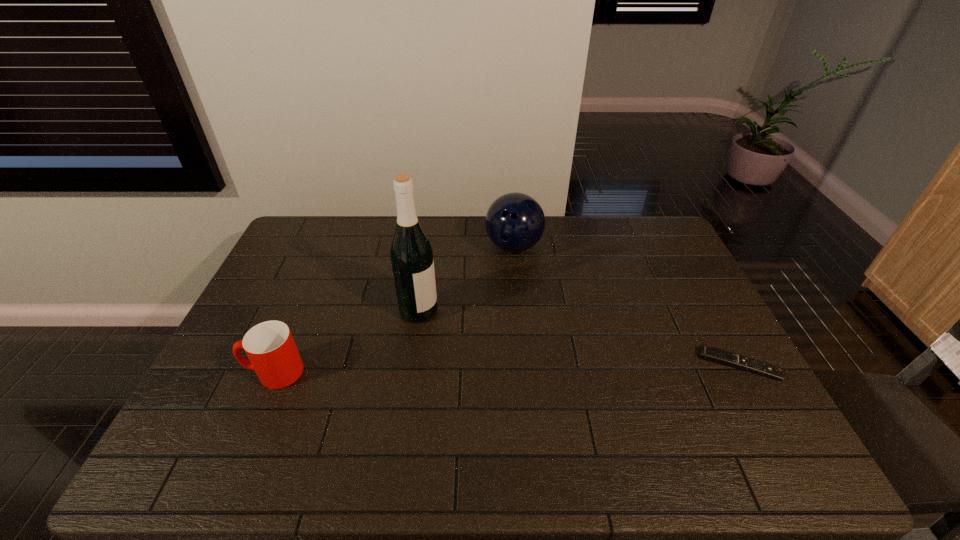
At what (x,y) coordinates should I click in order to perform the action: click on cup. Please return your answer as a coordinate pair (x, y). The image size is (960, 540). Looking at the image, I should click on (270, 347).

Find the location of a particular element. the leftmost object is located at coordinates (270, 347).

Locate an element on the screen. remote control is located at coordinates (708, 353).

Where is `the rightmost object`? The height and width of the screenshot is (540, 960). the rightmost object is located at coordinates (708, 353).

This screenshot has width=960, height=540. In order to click on the farthest object in this screenshot , I will do `click(515, 222)`.

Locate an element on the screen. The height and width of the screenshot is (540, 960). the second object from right to left is located at coordinates (515, 222).

Identify the location of wine bottle. This screenshot has width=960, height=540. (411, 254).

The height and width of the screenshot is (540, 960). I want to click on the third nearest object, so click(x=411, y=254).

Where is `vacant area located on the back of the remote control`? Image resolution: width=960 pixels, height=540 pixels. vacant area located on the back of the remote control is located at coordinates (720, 329).

This screenshot has width=960, height=540. Find the location of `blank area located 0.270m on the surface of the second object from right to left near the finger holes`. blank area located 0.270m on the surface of the second object from right to left near the finger holes is located at coordinates (511, 323).